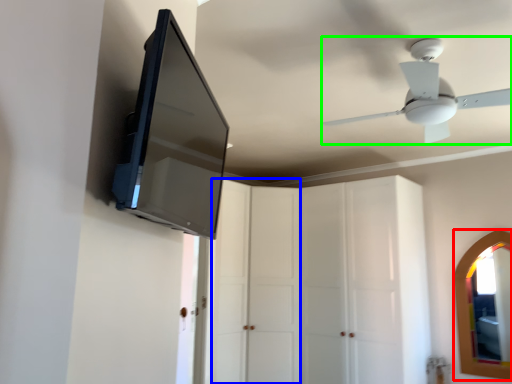
Question: Which is nearer to the mirror (highlighted by a red box)? glass door (highlighted by a blue box) or ceiling fan (highlighted by a green box).

Choices:
 (A) glass door
 (B) ceiling fan

Answer: (A)